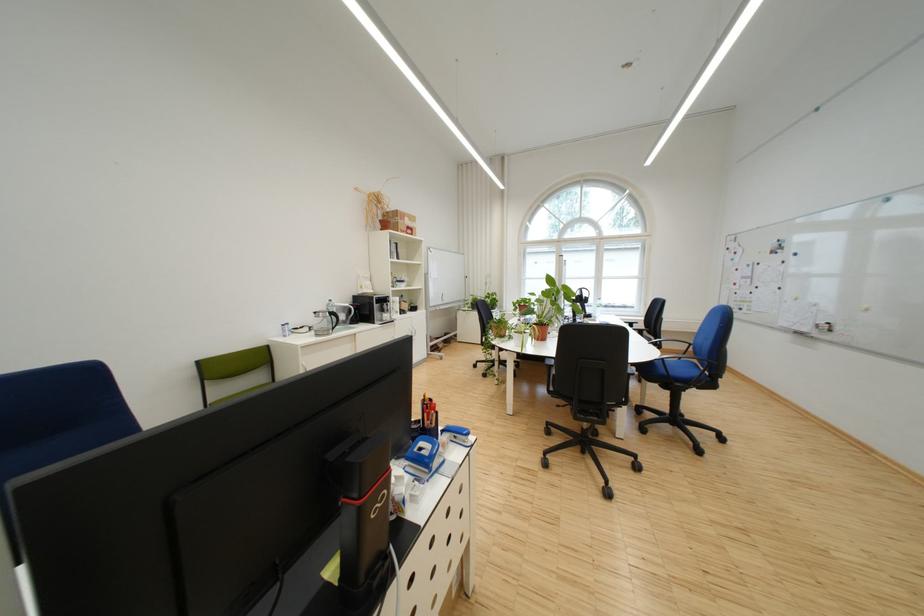
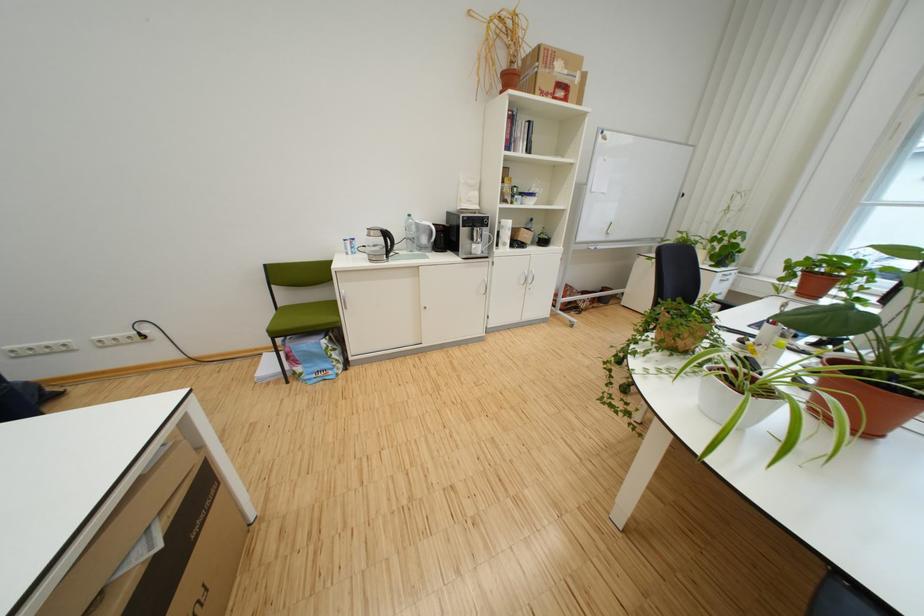
In the second image, find the point that corresponds to pixel 414 233 in the first image.

(553, 95)